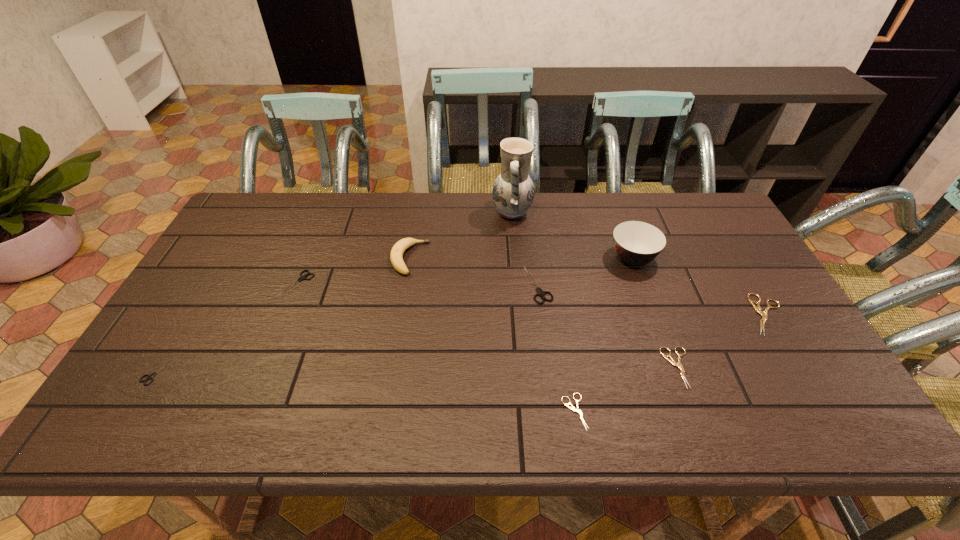
Locate an element on the screen. the rightmost shears is located at coordinates (764, 315).

This screenshot has height=540, width=960. Find the location of `the second farthest beige shears`. the second farthest beige shears is located at coordinates pyautogui.click(x=672, y=361).

This screenshot has height=540, width=960. What are the coordinates of `the second beige shears from right to left` in the screenshot? It's located at (672, 361).

Locate an element on the screen. The width and height of the screenshot is (960, 540). the leftmost object is located at coordinates (150, 377).

Locate an element on the screen. The image size is (960, 540). the nearest black shears is located at coordinates (150, 377).

Locate an element on the screen. the nearest beige shears is located at coordinates point(572,407).

Where is `the shortest shears`? the shortest shears is located at coordinates (572, 407).

Image resolution: width=960 pixels, height=540 pixels. In order to click on vacant space located 0.060m on either side of the farthest object in this screenshot , I will do tap(474, 213).

Locate an element on the screen. This screenshot has width=960, height=540. vacant position located on either side of the farthest object is located at coordinates [x=477, y=213].

This screenshot has width=960, height=540. What are the coordinates of `free space located 0.300m on either side of the farthest object` in the screenshot? It's located at (404, 213).